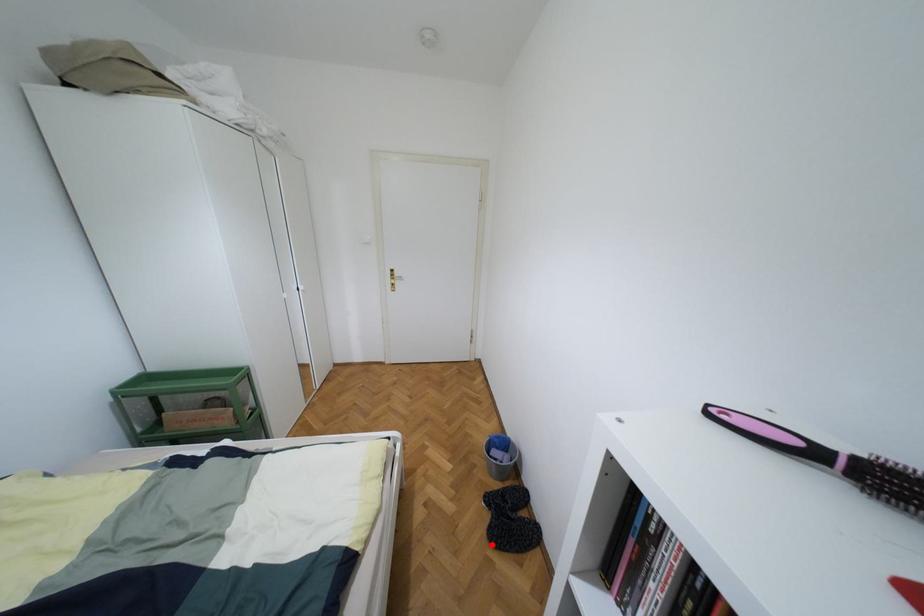
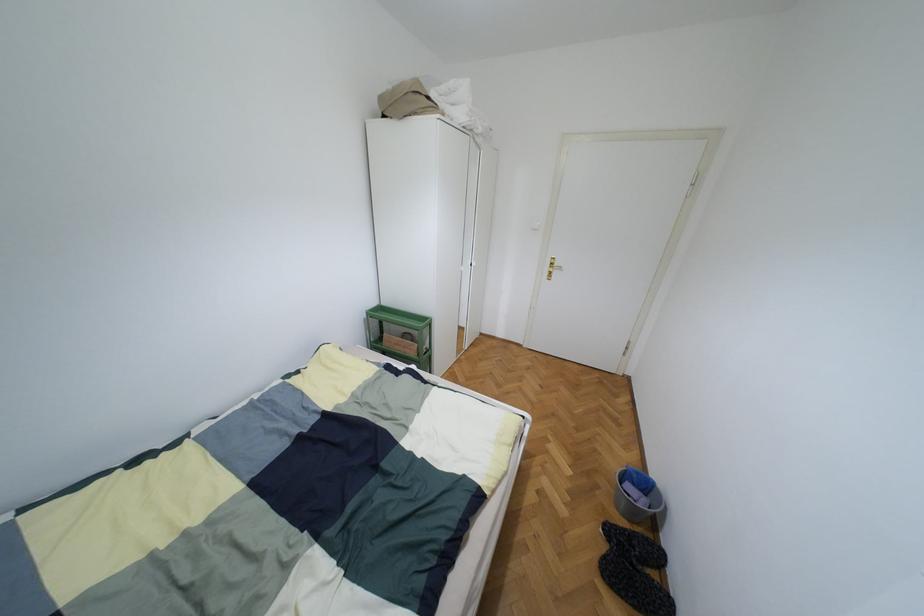
Find the pixel in the second image that matches the highlighted location in the first image.

(602, 577)